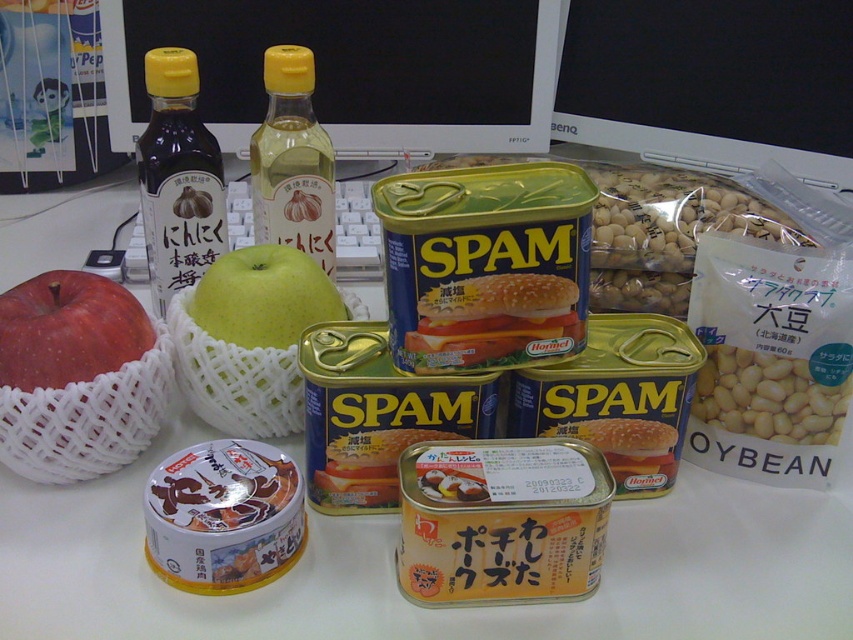
Question: Which point appears farthest from the camera in this image?

Choices:
 (A) click(773, 152)
 (B) click(538, 344)
 (C) click(323, 273)
 (D) click(334, 456)

Answer: (A)

Question: Is matte black monitor at upper center bigger than matte glass bottle at upper left?

Choices:
 (A) no
 (B) yes

Answer: (B)

Question: Considering the real-world distances, which object is closest to the matte black monitor at upper center?

Choices:
 (A) black glossy computer monitor at upper center
 (B) matte glass bottle at upper left

Answer: (A)

Question: Does red matte apple at left come behind white matte soybeans at right?

Choices:
 (A) no
 (B) yes

Answer: (A)

Question: Is matte black monitor at upper center further to the viewer compared to yellow plastic bottle at center?

Choices:
 (A) yes
 (B) no

Answer: (A)

Question: Among these points, which one is nearest to the camera?

Choices:
 (A) click(x=328, y=202)
 (B) click(x=780, y=401)
 (C) click(x=456, y=13)
 (D) click(x=474, y=365)

Answer: (D)